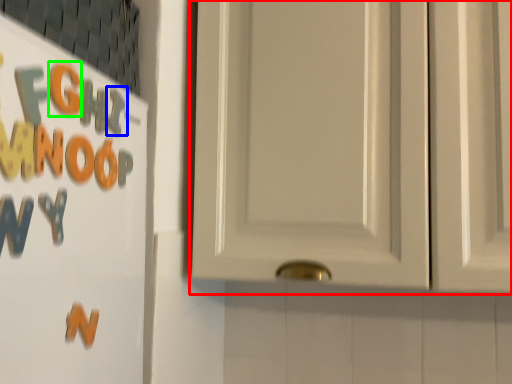
Question: Which object is positioned closest to door (highlighted by a red box)? Select from letter (highlighted by a blue box) and letter (highlighted by a green box).

Choices:
 (A) letter
 (B) letter

Answer: (A)